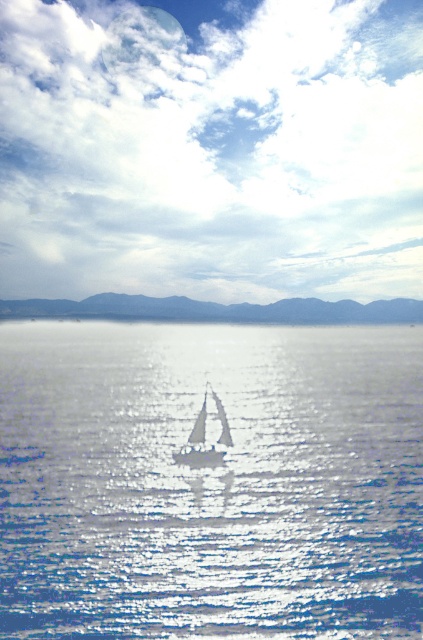
Question: Among these points, which one is farthest from the camera?

Choices:
 (A) (205, 424)
 (B) (172, 310)

Answer: (B)

Question: Which point appears closest to the camera in this image?

Choices:
 (A) (181, 310)
 (B) (208, 464)
 (C) (252, 532)

Answer: (C)

Question: Considering the relative positions of blue matte mountains at center and white matte sailboat at center in the image provided, where is blue matte mountains at center located with respect to white matte sailboat at center?

Choices:
 (A) left
 (B) right

Answer: (A)

Question: Which point is farther from the camera taking this photo?

Choices:
 (A) (128, 621)
 (B) (203, 442)
 (C) (379, 310)

Answer: (C)

Question: Can you confirm if glistening blue water at center is smaller than white matte sailboat at center?

Choices:
 (A) no
 (B) yes

Answer: (A)

Question: Is glistening blue water at center wider than blue matte mountains at center?

Choices:
 (A) yes
 (B) no

Answer: (B)